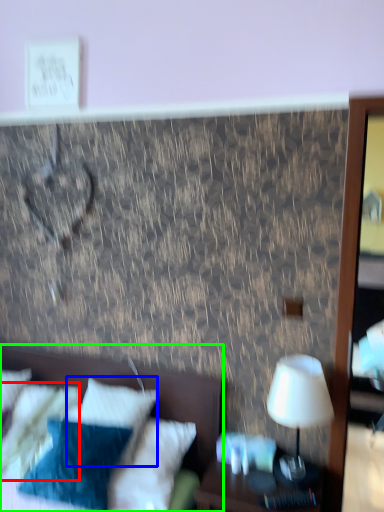
Question: Which object is positioned closest to pillow (highlighted by a red box)? Select from pillow (highlighted by a blue box) and bed (highlighted by a green box).

Choices:
 (A) pillow
 (B) bed

Answer: (A)